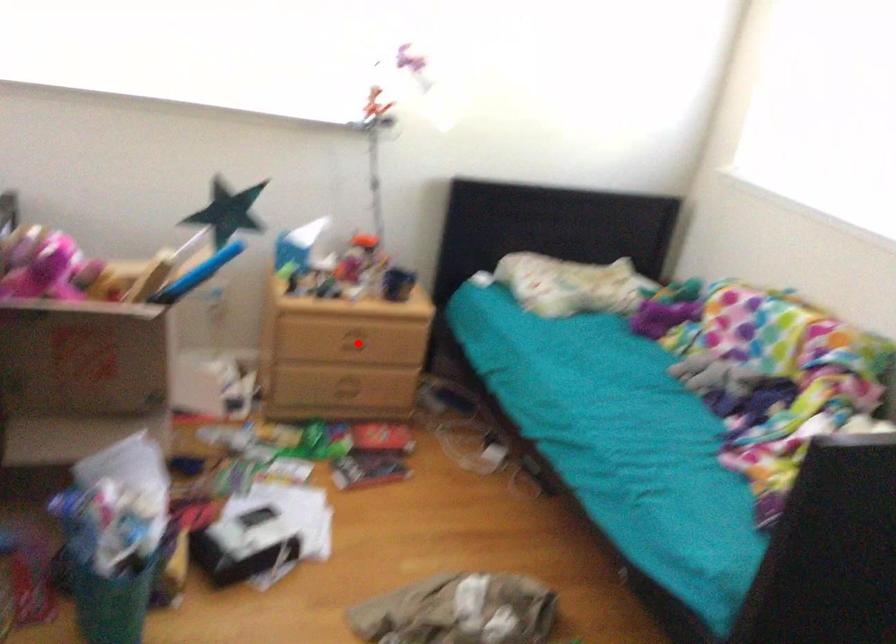
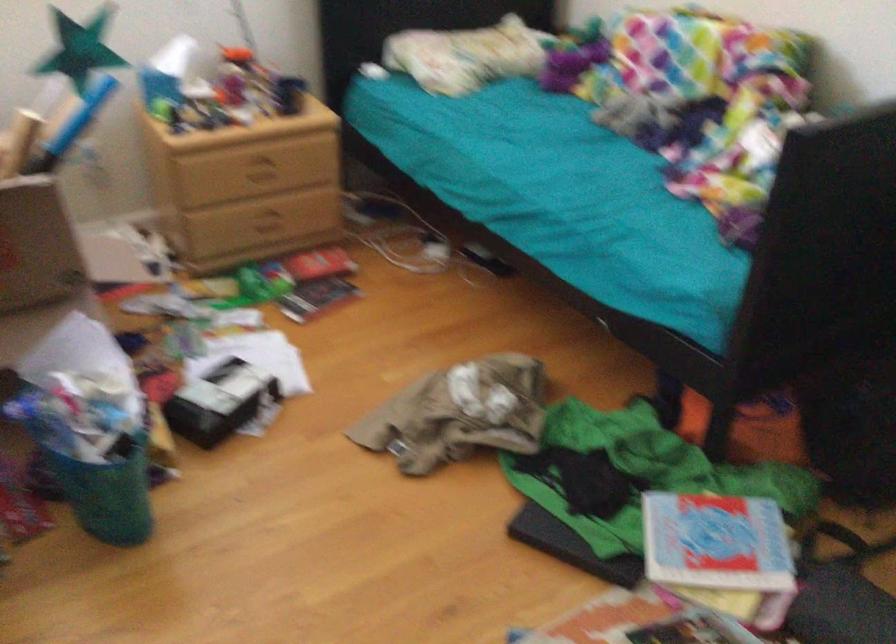
Question: I am providing you with two images of the same scene from different viewpoints. Given a red point in image1, look at the same physical point in image2. Is it:

Choices:
 (A) Closer to the viewpoint
 (B) Farther from the viewpoint

Answer: (A)